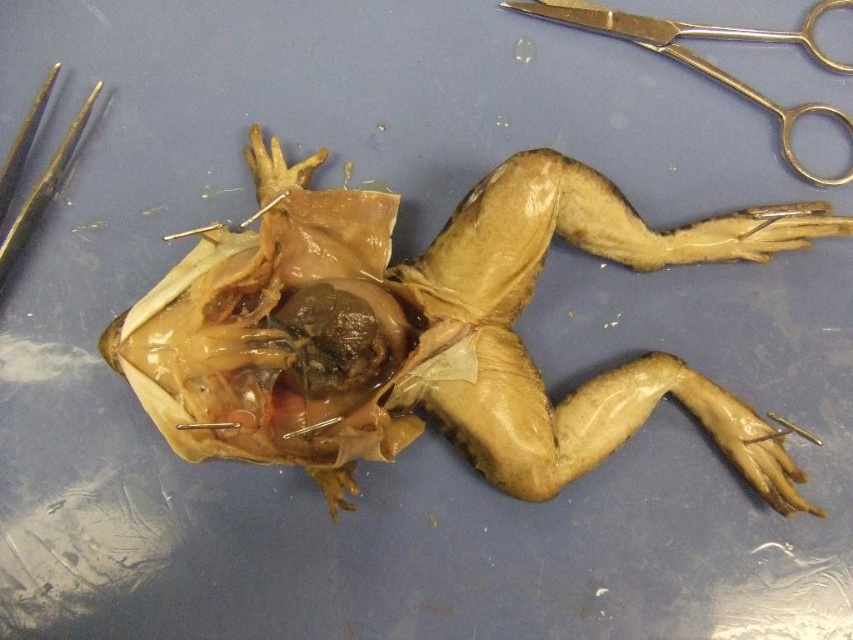
You are a student observing the frog dissection. You notice a specific point marked at coordinates (428,332). What anatomical feature is located at this point?

At point (428,332) lies translucent flesh at center.

You are a student observing a frog dissection. You notice the translucent flesh at center and the gold metallic forceps at upper left. Which object is positioned to the right of the other?

The translucent flesh at center is to the right of gold metallic forceps at upper left.

You are a student observing a frog dissection. You need to locate the translucent flesh at center. Where exactly is it positioned in the image?

The translucent flesh at center is located at point coordinates of (x=428, y=332).